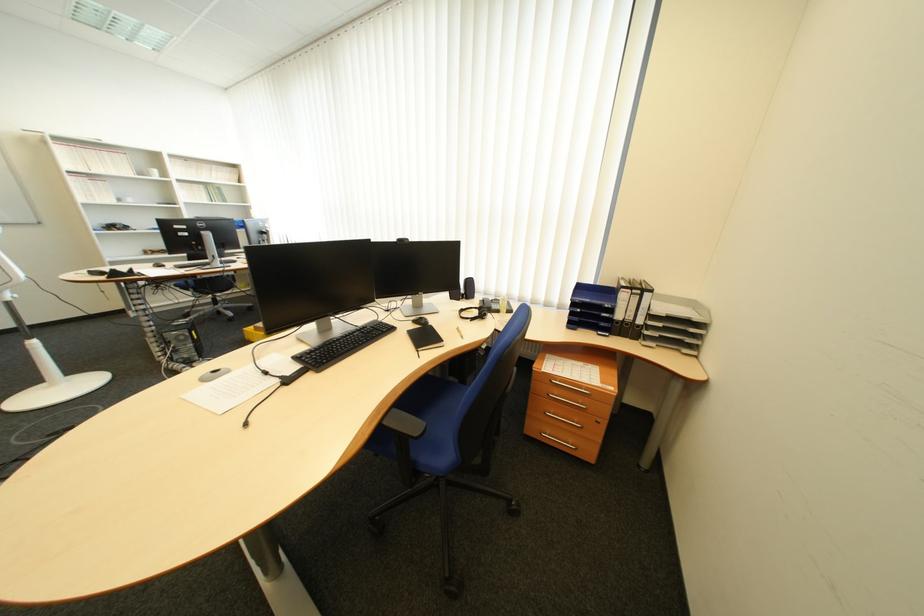
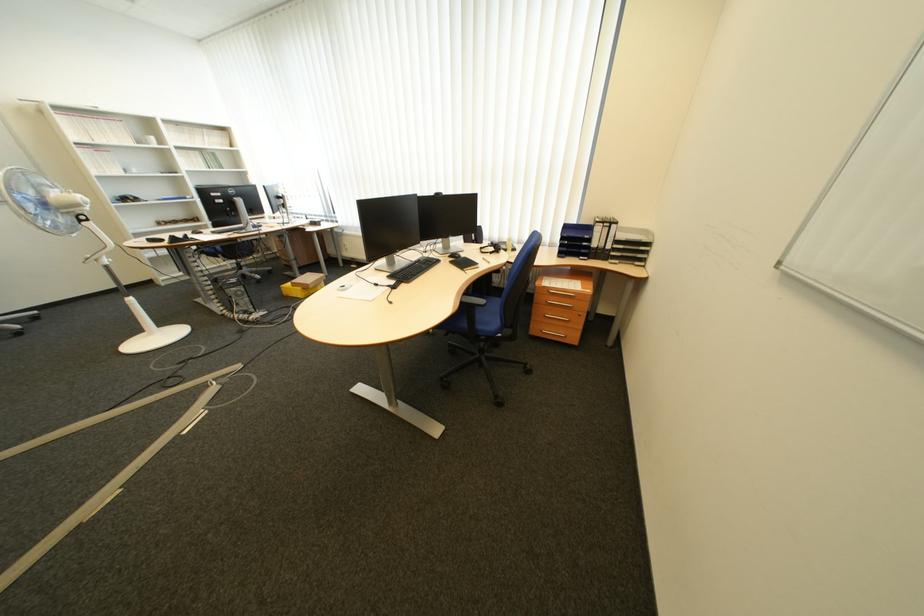
Where in the second image is the point corresponding to the point at 428,323 from the first image?

(464, 257)